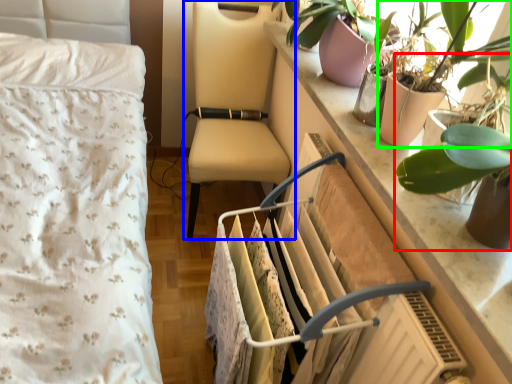
Question: Which object is the closest to the houseplant (highlighted by a red box)? Choose among these: chair (highlighted by a blue box) or houseplant (highlighted by a green box).

Choices:
 (A) chair
 (B) houseplant

Answer: (B)